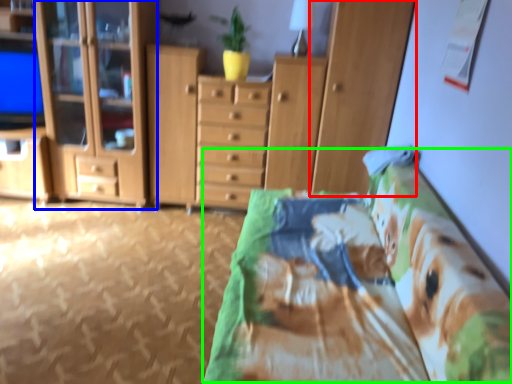
Question: Considering the real-world distances, which object is closest to cabinetry (highlighted by a red box)? cabinetry (highlighted by a blue box) or bed (highlighted by a green box).

Choices:
 (A) cabinetry
 (B) bed

Answer: (B)